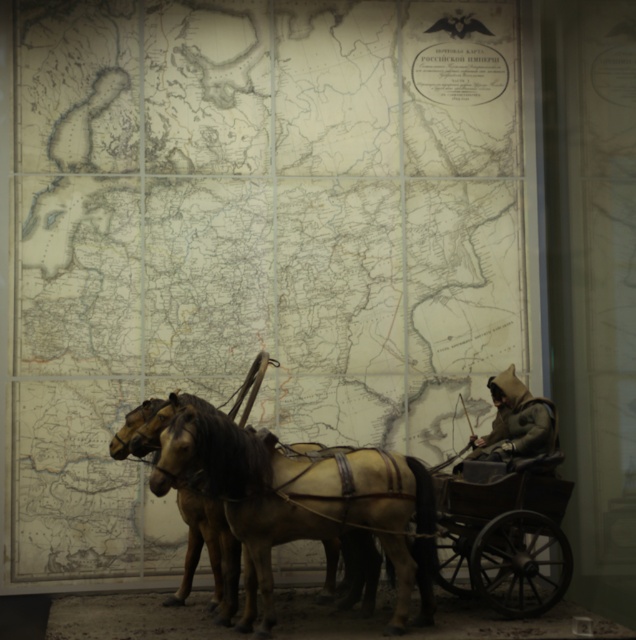
Based on the photo, you are a traveler standing at the point marked by the coordinates (265, 477) in the image. Looking around, you see the light brown leather horse cart at center. Which direction should you walk to reach the map of the Russian Empire?

The point at (265, 477) corresponds to the light brown leather horse cart at center. Since the map of the Russian Empire is in the background, you should walk forward from the point to reach it.